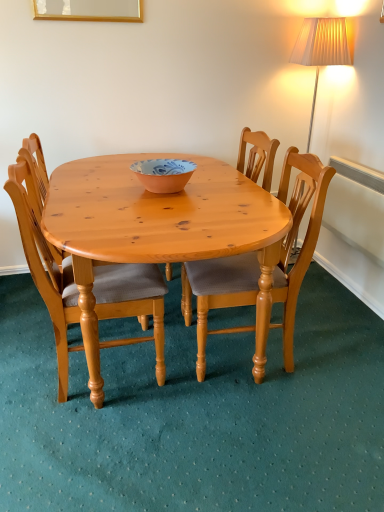
This screenshot has height=512, width=384. Identify the location of free space in front of light brown wooden chair at center, the first chair when ordered from left to right. 102,452.